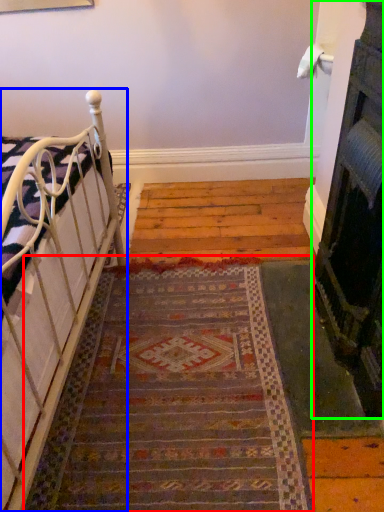
Question: Which object is positioned farthest from doormat (highlighted by a red box)? Select from furniture (highlighted by a blue box) and fireplace (highlighted by a green box).

Choices:
 (A) furniture
 (B) fireplace

Answer: (B)